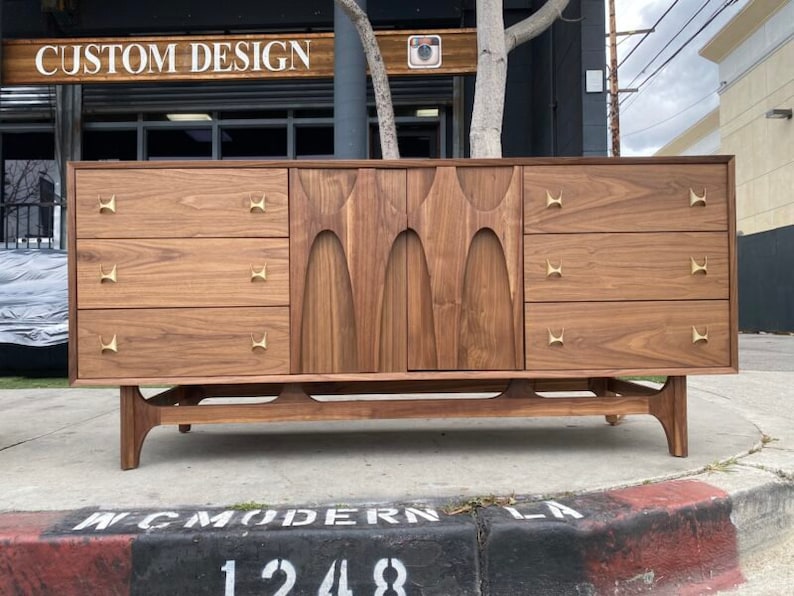
The width and height of the screenshot is (794, 596). What are the coordinates of `drawers of dresser` in the screenshot? It's located at (193, 200), (172, 291), (167, 347), (649, 212), (640, 271), (623, 350).